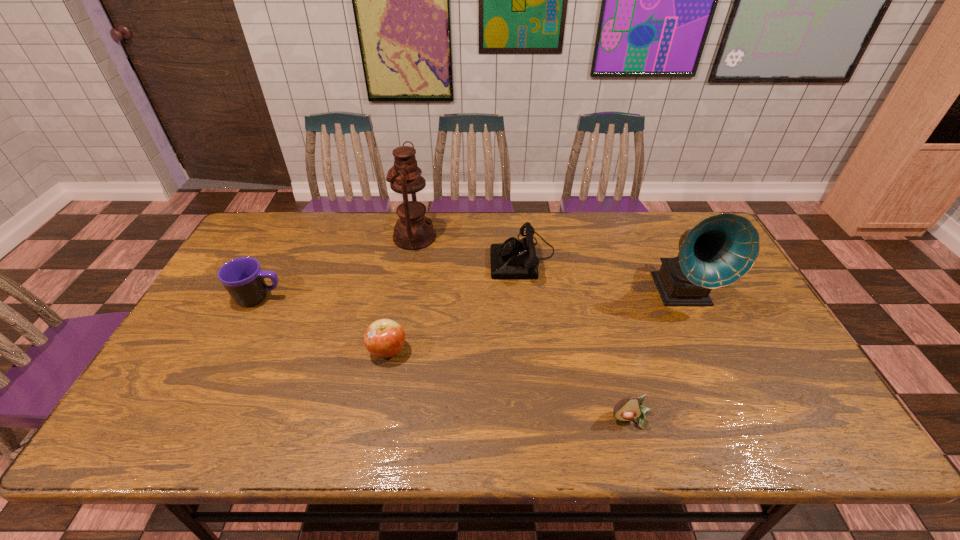
The width and height of the screenshot is (960, 540). I want to click on empty space that is in between the rightmost object and the fifth farthest object, so click(x=535, y=321).

Where is `unoccupied position between the second nearest object and the mug`? unoccupied position between the second nearest object and the mug is located at coordinates pyautogui.click(x=324, y=324).

The image size is (960, 540). I want to click on free area in between the mug and the telephone, so click(392, 277).

Locate an element on the screen. This screenshot has width=960, height=540. vacant area that lies between the fourth object from left to right and the oil lamp is located at coordinates (468, 246).

I want to click on free space between the fourth object from left to right and the oil lamp, so click(468, 246).

Where is `free space between the nearest object and the leftmost object`? free space between the nearest object and the leftmost object is located at coordinates (445, 359).

Identify the location of object that is the fourth closest to the nearest object. (413, 231).

Point out which object is positioned as the second nearest to the leftmost object. Please provide its 2D coordinates. Your answer should be formatted as a tuple, i.e. [(x, y)], where the tuple contains the x and y coordinates of a point satisfying the conditions above.

[(413, 231)]

Locate an element on the screen. This screenshot has height=540, width=960. free space in the image that satisfies the following two spatial constraints: 1. from the horn of the phonograph_record; 2. with the handle on the side of the mug is located at coordinates (684, 298).